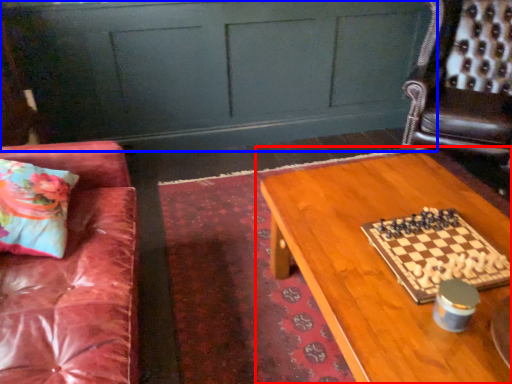
Question: Among these objects, which one is farthest to the camera, table (highlighted by a red box) or dresser (highlighted by a blue box)?

Choices:
 (A) table
 (B) dresser

Answer: (B)